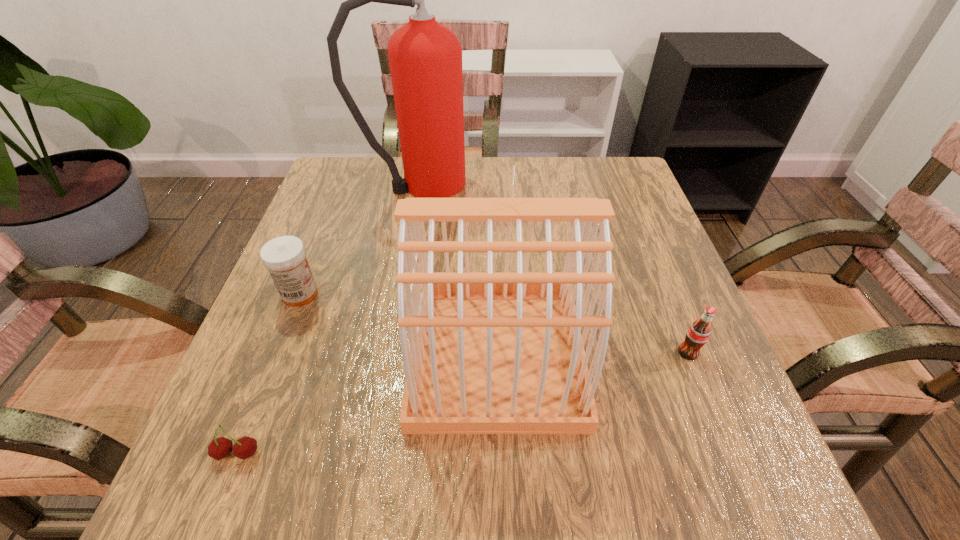
Where is `fire extinguisher`? Image resolution: width=960 pixels, height=540 pixels. fire extinguisher is located at coordinates (425, 57).

At what (x,y) coordinates should I click in order to perform the action: click on the tallest object. Please return your answer as a coordinate pair (x, y). Looking at the image, I should click on (425, 57).

Find the location of a particular element. birdcage is located at coordinates (490, 352).

Where is `medicine`? The width and height of the screenshot is (960, 540). medicine is located at coordinates (285, 257).

This screenshot has width=960, height=540. I want to click on soda, so click(698, 333).

Identify the location of cherry. The height and width of the screenshot is (540, 960). (245, 447).

This screenshot has width=960, height=540. I want to click on the shortest object, so click(x=245, y=447).

The image size is (960, 540). In order to click on vacant area situated 0.060m on the handle side of the farthest object in this screenshot , I will do `click(496, 184)`.

Find the location of a particular element. free region located with an open door on the fourth shortest object is located at coordinates (313, 354).

I want to click on free region located 0.240m with an open door on the fourth shortest object, so pyautogui.click(x=272, y=354).